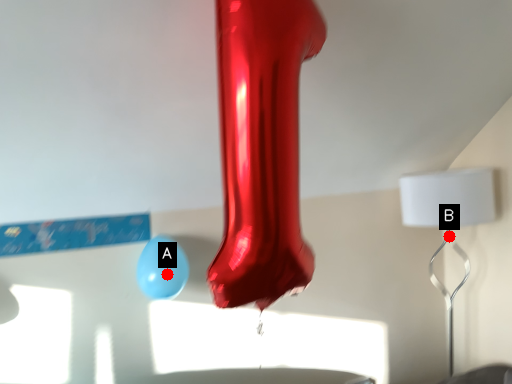
Question: Two points are circled on the image, labeled by A and B beside each circle. Among these points, which one is farthest from the camera?

Choices:
 (A) A is further
 (B) B is further

Answer: (B)